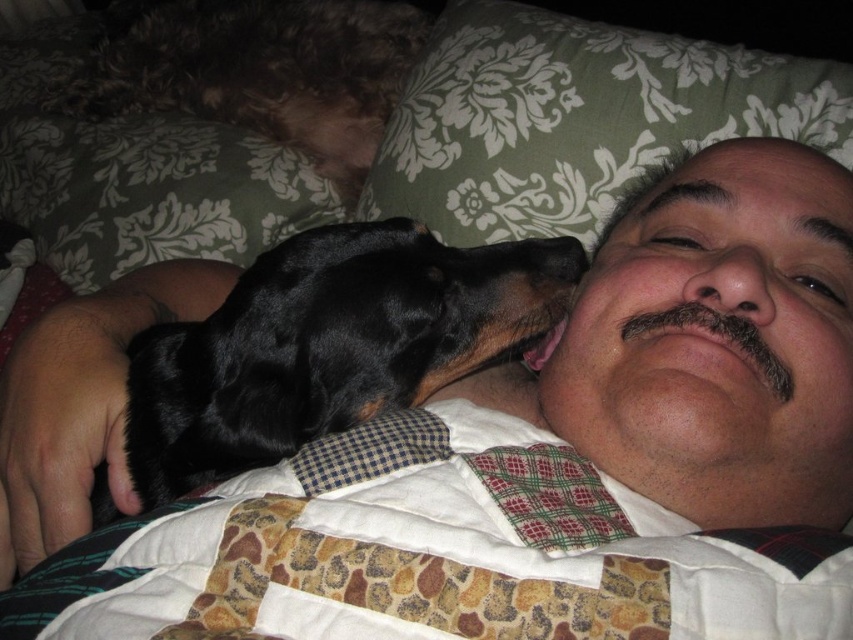
Question: Can you confirm if black fur dog at center is positioned below black smooth nose at center?

Choices:
 (A) yes
 (B) no

Answer: (A)

Question: Which object is farther from the camera taking this photo?

Choices:
 (A) green floral fabric at upper center
 (B) black smooth nose at center
 (C) black fur dog at center

Answer: (A)

Question: Can you confirm if black fur dog at center is positioned below fuzzy brown dog at upper left?

Choices:
 (A) no
 (B) yes

Answer: (B)

Question: Which object is farther from the camera taking this photo?

Choices:
 (A) fuzzy brown dog at upper left
 (B) black fur dog at center
 (C) black smooth nose at center
 (D) green floral fabric at upper center

Answer: (A)

Question: Among these points, which one is nearest to the camera?

Choices:
 (A) (692, 275)
 (B) (505, 344)

Answer: (A)

Question: Can you confirm if black fur dog at center is positioned above green floral fabric at upper center?

Choices:
 (A) yes
 (B) no

Answer: (B)